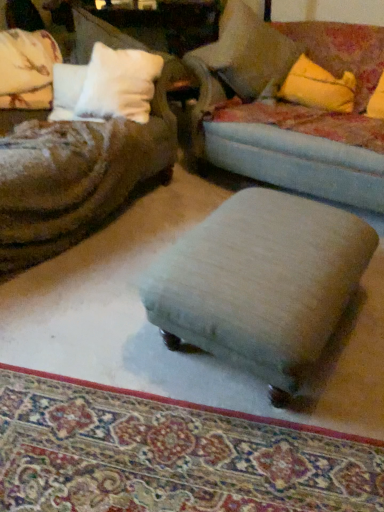
Question: Is velvet blue studio couch at center bigger or smaller than soft beige pillow at upper right, arranged as the first pillow when viewed from the right?

Choices:
 (A) big
 (B) small

Answer: (A)

Question: Considering the relative positions of velvet blue studio couch at center and soft beige pillow at upper right, arranged as the first pillow when viewed from the right, in the image provided, is velvet blue studio couch at center to the left or to the right of soft beige pillow at upper right, arranged as the first pillow when viewed from the right,?

Choices:
 (A) left
 (B) right

Answer: (B)

Question: Which object is the closest to the soft beige pillow at upper right, arranged as the first pillow when viewed from the right?

Choices:
 (A) beige fabric ottoman at center
 (B) light beige fabric stool at center
 (C) yellow fabric pillow at upper right
 (D) velvet blue studio couch at center
 (E) white soft pillow at upper left, which appears as the 1th pillow when viewed from the left

Answer: (D)

Question: Which of these objects is positioned closest to the soft beige pillow at upper right, the second pillow in the left-to-right sequence?

Choices:
 (A) velvet blue studio couch at center
 (B) light beige fabric stool at center
 (C) white soft pillow at upper left, which is the 2th pillow from right to left
 (D) yellow fabric pillow at upper right
 (E) beige fabric ottoman at center

Answer: (A)